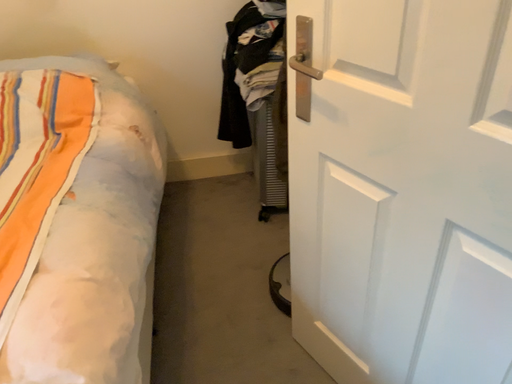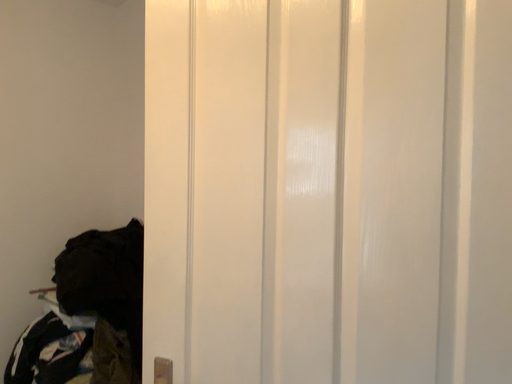
Question: How did the camera likely rotate when shooting the video?

Choices:
 (A) rotated left
 (B) rotated right

Answer: (B)